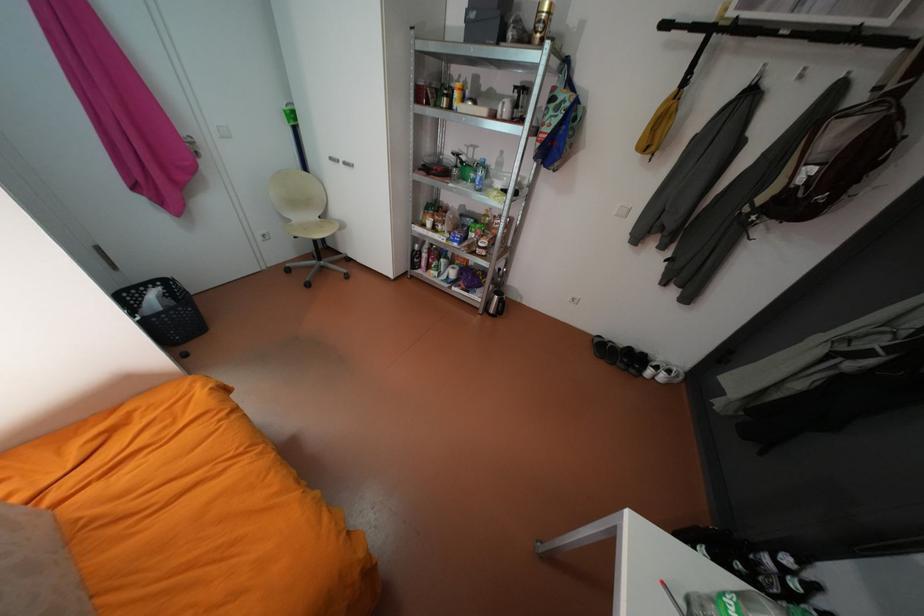
At what (x,y) coordinates should I click in order to perform the action: click on yellow umbrella handle. Please return your answer as a coordinate pair (x, y). Looking at the image, I should click on (703, 39).